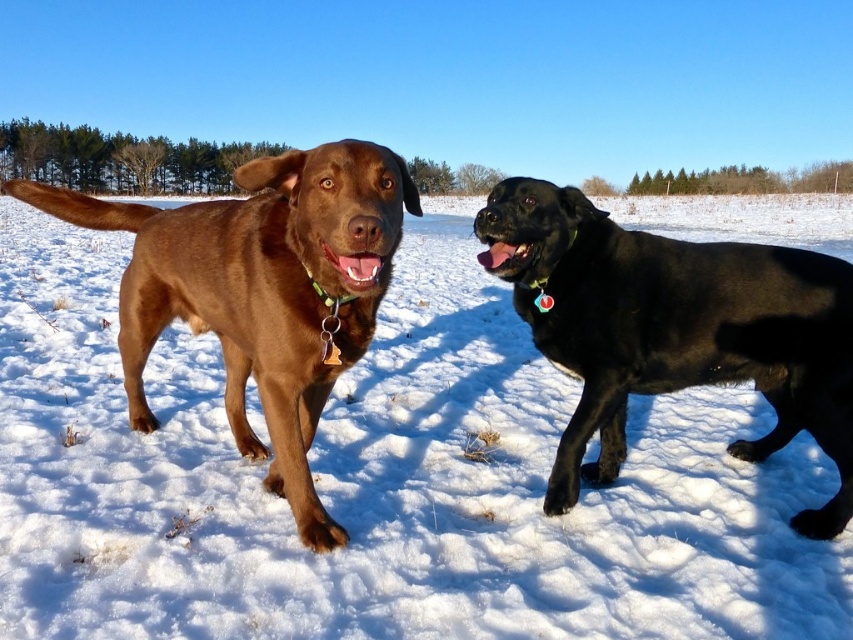
Question: Which point appears closest to the camera in this image?

Choices:
 (A) (309, 339)
 (B) (259, 556)

Answer: (A)

Question: Considering the real-world distances, which object is closest to the matte brown dog at left?

Choices:
 (A) white fluffy snow at center
 (B) black glossy dog at right

Answer: (B)

Question: Does black glossy dog at right appear over matte brown dog at left?

Choices:
 (A) yes
 (B) no

Answer: (B)

Question: From the image, what is the correct spatial relationship of white fluffy snow at center in relation to black glossy dog at right?

Choices:
 (A) above
 (B) below

Answer: (A)

Question: Which of the following is the farthest from the observer?

Choices:
 (A) (318, 172)
 (B) (637, 369)
 (C) (32, 225)

Answer: (C)

Question: Can you confirm if white fluffy snow at center is smaller than matte brown dog at left?

Choices:
 (A) no
 (B) yes

Answer: (A)